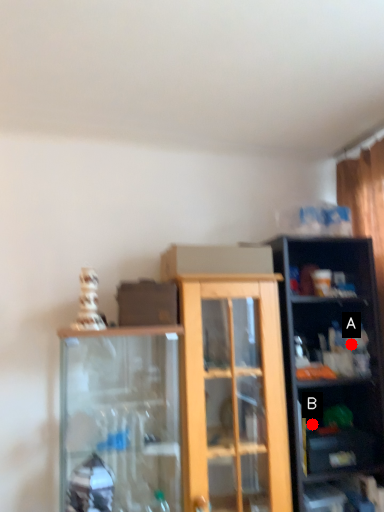
Question: Two points are circled on the image, labeled by A and B beside each circle. Which point is closer to the camera?

Choices:
 (A) A is closer
 (B) B is closer

Answer: (B)